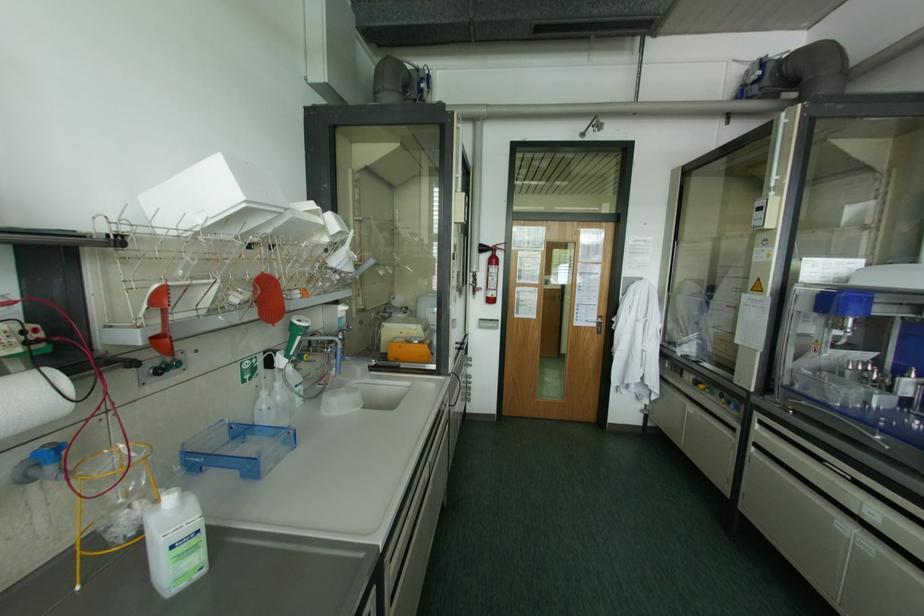
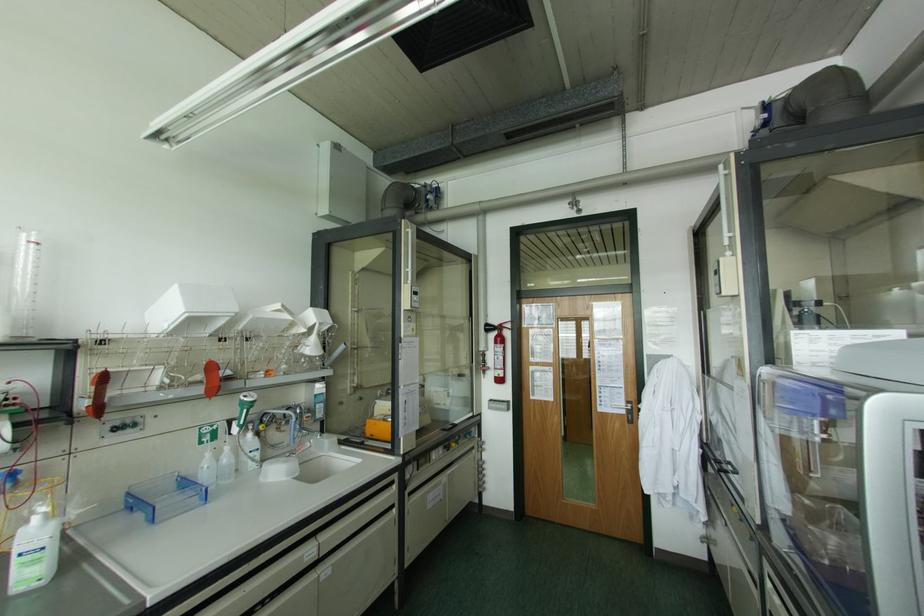
Locate, in the second image, the point that corresponds to point (599, 315) in the first image.

(626, 400)